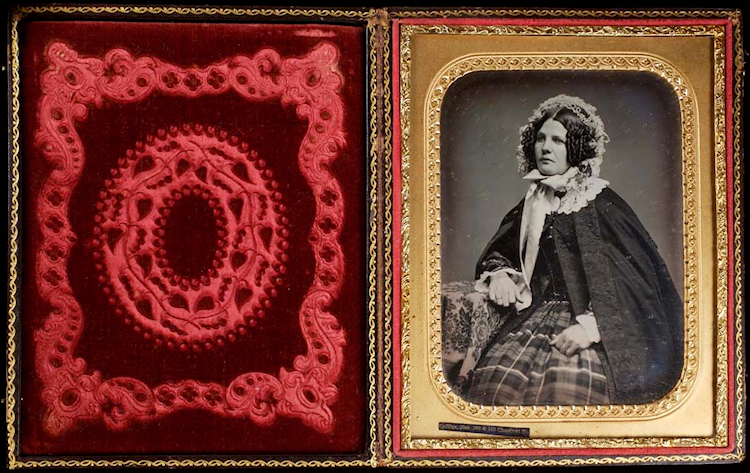
You are a GUI agent. You are given a task and a screenshot of the screen. Output one action in this format:
    pyautogui.click(x=<x>, y=<y>)
    Task: Click on the picture frame
    This screenshot has height=473, width=750.
    Given the screenshot: What is the action you would take?
    pyautogui.click(x=8, y=318), pyautogui.click(x=396, y=299)